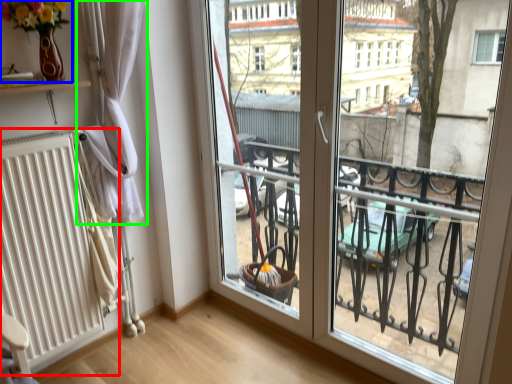
Question: Which object is positioned closest to radiator (highlighted by a red box)? Select from floral arrangement (highlighted by a blue box) and curtain (highlighted by a green box).

Choices:
 (A) floral arrangement
 (B) curtain

Answer: (B)